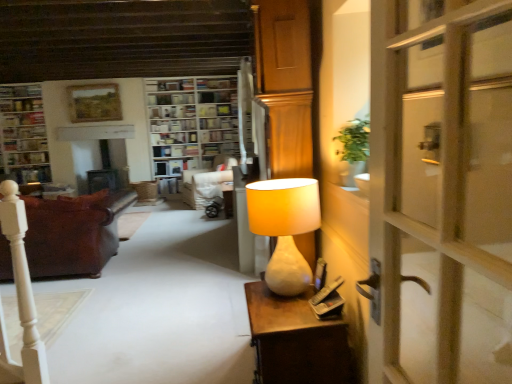
The image size is (512, 384). Describe the element at coordinates (285, 228) in the screenshot. I see `matte white lamp at right` at that location.

Locate an element on the screen. The image size is (512, 384). matte white lamp at right is located at coordinates (285, 228).

Identify the location of wooden framed painting at upper center. (94, 103).

Does wooden bookshelf at center have a smaller size compared to wooden framed painting at upper center?

Actually, wooden bookshelf at center might be larger than wooden framed painting at upper center.

Does point (210, 156) come closer to viewer compared to point (71, 90)?

No, (210, 156) is further to viewer.

How different are the orientations of wooden bookshelf at center and wooden framed painting at upper center in degrees?

The angle between the facing direction of wooden bookshelf at center and the facing direction of wooden framed painting at upper center is 0.49 degrees.

Is wooden bookshelf at center facing towards wooden framed painting at upper center?

No, wooden bookshelf at center is not turned towards wooden framed painting at upper center.

Is green leafy plant at upper right wider or thinner than white fabric chair at center?

Clearly, green leafy plant at upper right has less width compared to white fabric chair at center.

Based on the photo, from a real-world perspective, is green leafy plant at upper right under white fabric chair at center?

Actually, green leafy plant at upper right is physically above white fabric chair at center in the real world.

Is point (367, 120) closer or farther from the camera than point (226, 165)?

Point (367, 120) is closer to the camera than point (226, 165).

Is green leafy plant at upper right touching white fabric chair at center?

No, green leafy plant at upper right is not beside white fabric chair at center.

The width and height of the screenshot is (512, 384). I want to click on shelf below the green leafy plant at upper right (from a real-world perspective), so click(x=174, y=138).

Who is bigger, green leafy plant at upper right or wooden bookshelf at center, which is counted as the 1th shelf, starting from the bottom?

With larger size is wooden bookshelf at center, which is counted as the 1th shelf, starting from the bottom.

In the scene shown: Is wooden bookshelf at center, which is the 2th shelf in top-to-bottom order, inside green leafy plant at upper right?

No, wooden bookshelf at center, which is the 2th shelf in top-to-bottom order, is not a part of green leafy plant at upper right.

Which is closer, (180, 100) or (301, 288)?

Point (180, 100) is farther from the camera than point (301, 288).

What's the angular difference between white wooden bookshelf at upper center, the 1th shelf positioned from the top, and matte white lamp at right's facing directions?

The facing directions of white wooden bookshelf at upper center, the 1th shelf positioned from the top, and matte white lamp at right are 92 degrees apart.

Does white wooden bookshelf at upper center, the 2th shelf ordered from the bottom, have a lesser width compared to matte white lamp at right?

Indeed, white wooden bookshelf at upper center, the 2th shelf ordered from the bottom, has a lesser width compared to matte white lamp at right.

Could matte white lamp at right be considered to be inside white wooden bookshelf at upper center, the 1th shelf positioned from the top?

No, matte white lamp at right is not inside white wooden bookshelf at upper center, the 1th shelf positioned from the top.

Is white paper bookshelf at upper center, the 1th book from the right, not inside hardcover book at upper left, which appears as the 2th book when viewed from the top?

Yes, white paper bookshelf at upper center, the 1th book from the right, is not within hardcover book at upper left, which appears as the 2th book when viewed from the top.

Could you measure the distance between white paper bookshelf at upper center, the first book in the top-to-bottom sequence, and hardcover book at upper left, marked as the second book in a right-to-left arrangement?

white paper bookshelf at upper center, the first book in the top-to-bottom sequence, and hardcover book at upper left, marked as the second book in a right-to-left arrangement, are 6.34 feet apart.

Is white paper bookshelf at upper center, the first book in the top-to-bottom sequence, facing towards hardcover book at upper left, acting as the first book starting from the bottom?

No, white paper bookshelf at upper center, the first book in the top-to-bottom sequence, is not facing towards hardcover book at upper left, acting as the first book starting from the bottom.

Which object is closer to the camera, white paper bookshelf at upper center, the second book from the left, or hardcover book at upper left, the first book when ordered from left to right?

hardcover book at upper left, the first book when ordered from left to right, is more forward.

Is white marble desk at right oriented away from leather couch at left?

No, white marble desk at right is not facing the opposite direction of leather couch at left.

Is white marble desk at right further to the viewer compared to leather couch at left?

No, it is not.

From the image's perspective, is white marble desk at right above or below leather couch at left?

white marble desk at right is situated lower than leather couch at left in the image.

The height and width of the screenshot is (384, 512). I want to click on desk on the right of the leather couch at left, so click(x=295, y=340).

How many degrees apart are the facing directions of leather couch at left and white wooden bookshelf at upper center, the 1th shelf positioned from the top?

There is a 179-degree angle between the facing directions of leather couch at left and white wooden bookshelf at upper center, the 1th shelf positioned from the top.

In the image, is leather couch at left on the left side or the right side of white wooden bookshelf at upper center, the 2th shelf ordered from the bottom?

leather couch at left is positioned on white wooden bookshelf at upper center, the 2th shelf ordered from the bottom,'s left side.

Is white wooden bookshelf at upper center, the 2th shelf ordered from the bottom, surrounded by leather couch at left?

No, leather couch at left does not contain white wooden bookshelf at upper center, the 2th shelf ordered from the bottom.

Is leather couch at left facing towards white wooden bookshelf at upper center, the 1th shelf positioned from the top?

No, leather couch at left does not turn towards white wooden bookshelf at upper center, the 1th shelf positioned from the top.

Where is `bookshelf directly beneath the wooden framed painting at upper center (from a real-world perspective)`? This screenshot has width=512, height=384. bookshelf directly beneath the wooden framed painting at upper center (from a real-world perspective) is located at coordinates (192, 130).

Identify the location of chair located behind the green leafy plant at upper right. This screenshot has width=512, height=384. (207, 182).

Considering their positions, is white paper bookshelf at upper center, the second book from the left, positioned closer to wooden bookshelf at center, which is the 2th shelf in top-to-bottom order, than green leafy plant at upper right?

white paper bookshelf at upper center, the second book from the left, is positioned closer to the anchor wooden bookshelf at center, which is the 2th shelf in top-to-bottom order.

Looking at the image, which one is located closer to white paper bookshelf at upper center, which is the second book in bottom-to-top order, wooden bookshelf at upper left or matte white lamp at right?

The object closer to white paper bookshelf at upper center, which is the second book in bottom-to-top order, is wooden bookshelf at upper left.

From the image, which object appears to be nearer to leather couch at left, white paper bookshelf at upper center, the second book from the left, or white marble desk at right?

Based on the image, white paper bookshelf at upper center, the second book from the left, appears to be nearer to leather couch at left.

When comparing their distances from wooden framed painting at upper center, does white wooden bookshelf at upper center, the 2th shelf ordered from the bottom, or leather couch at left seem closer?

white wooden bookshelf at upper center, the 2th shelf ordered from the bottom.

Based on their spatial positions, is white marble desk at right or wooden framed painting at upper center further from wooden bookshelf at center, which is the 2th shelf in top-to-bottom order?

Among the two, white marble desk at right is located further to wooden bookshelf at center, which is the 2th shelf in top-to-bottom order.

From the image, which object appears to be farther from wooden bookshelf at center, white marble desk at right or white paper bookshelf at upper center, the 1th book from the right?

Based on the image, white marble desk at right appears to be further to wooden bookshelf at center.

When comparing their distances from white paper bookshelf at upper center, the first book in the top-to-bottom sequence, does white marble desk at right or hardcover book at upper left, which appears as the 2th book when viewed from the top, seem further?

white marble desk at right.

Estimate the real-world distances between objects in this image. Which object is closer to white marble desk at right, matte white lamp at right or hardcover book at upper left, the first book when ordered from left to right?

matte white lamp at right lies closer to white marble desk at right than the other object.

The height and width of the screenshot is (384, 512). I want to click on bookshelf located between green leafy plant at upper right and wooden bookshelf at center, which is counted as the 1th shelf, starting from the bottom, in the depth direction, so click(192, 130).

Locate an element on the screen. studio couch located between green leafy plant at upper right and hardcover book at upper left, the first book when ordered from left to right, in the depth direction is located at coordinates (73, 233).

I want to click on lamp between white marble desk at right and wooden bookshelf at upper left along the z-axis, so click(285, 228).

Locate an element on the screen. cabinetry positioned between green leafy plant at upper right and hardcover book at upper left, marked as the second book in a right-to-left arrangement, from near to far is located at coordinates (23, 134).